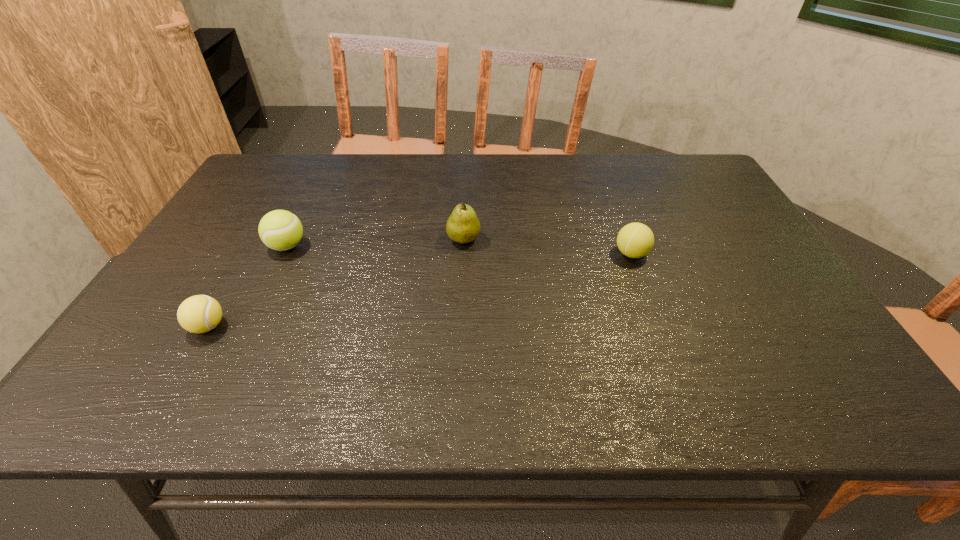
Where is `vacant space at the far edge of the desktop`? The image size is (960, 540). vacant space at the far edge of the desktop is located at coordinates (460, 190).

The image size is (960, 540). I want to click on vacant space at the near edge of the desktop, so click(x=533, y=379).

Image resolution: width=960 pixels, height=540 pixels. Find the location of `blank space at the left edge of the desktop`. blank space at the left edge of the desktop is located at coordinates (276, 198).

Where is `vacant space at the right edge`? The height and width of the screenshot is (540, 960). vacant space at the right edge is located at coordinates (707, 221).

Identify the location of vacant space at the near right corner. Image resolution: width=960 pixels, height=540 pixels. (840, 379).

The width and height of the screenshot is (960, 540). I want to click on free spot between the nearest tennis ball and the tallest tennis ball, so click(x=248, y=286).

Identify the location of empty location between the rightmost tennis ball and the nearest tennis ball. (420, 290).

This screenshot has width=960, height=540. Find the location of `free space that is in between the nearest tennis ball and the second object from right to left`. free space that is in between the nearest tennis ball and the second object from right to left is located at coordinates (336, 283).

You are a GUI agent. You are given a task and a screenshot of the screen. Output one action in this format:
    pyautogui.click(x=<x>, y=<y>)
    Task: Click on the free area in between the second tallest object and the rightmost tennis ball
    The height and width of the screenshot is (540, 960).
    Given the screenshot: What is the action you would take?
    pyautogui.click(x=459, y=250)

Where is `free space between the pear and the nearest tennis ball`? Image resolution: width=960 pixels, height=540 pixels. free space between the pear and the nearest tennis ball is located at coordinates (336, 283).